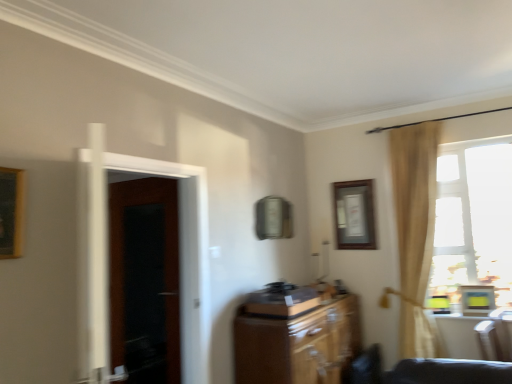
Question: Considering the positions of point (134, 289) and point (303, 321), is point (134, 289) closer or farther from the camera than point (303, 321)?

Choices:
 (A) farther
 (B) closer

Answer: (A)

Question: Is dark wood door at left taller or shorter than wooden cabinet at center?

Choices:
 (A) tall
 (B) short

Answer: (A)

Question: Which object is the farthest from the wooden picture frame at upper center?

Choices:
 (A) dark wood screen door at left
 (B) wooden record player at center
 (C) dark wood door at left
 (D) transparent glass window at right
 (E) wooden cabinet at center

Answer: (C)

Question: Estimate the real-world distances between objects in this image. Which object is farther from the wooden picture frame at upper center?

Choices:
 (A) wooden cabinet at center
 (B) dark wood screen door at left
 (C) transparent glass window at right
 (D) wooden record player at center
 (E) dark wood door at left

Answer: (E)